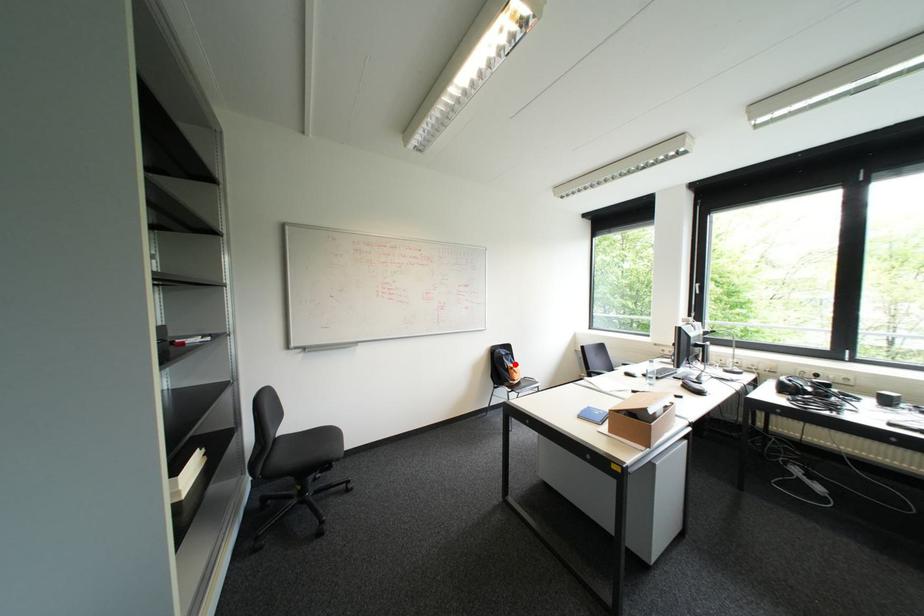
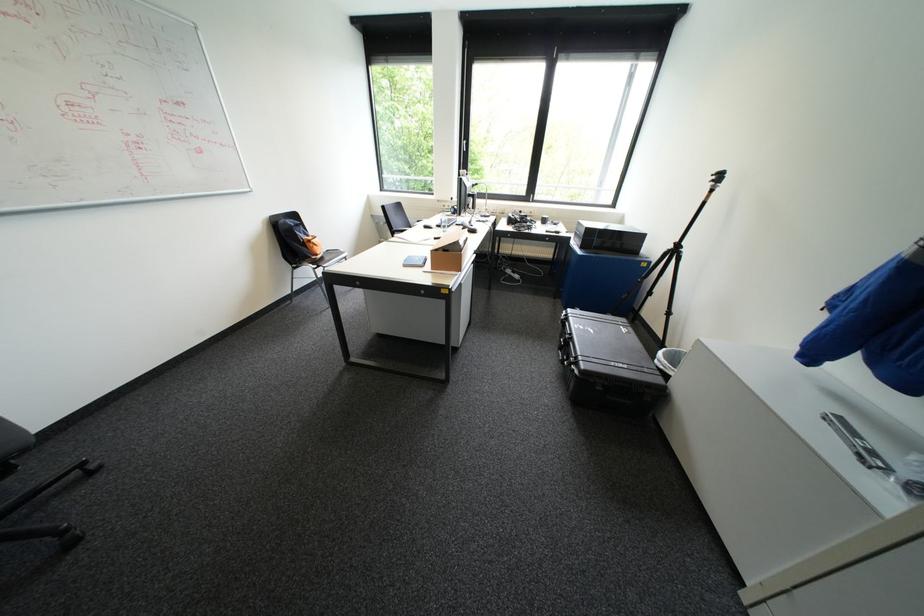
Question: I am providing you with two images of the same scene from different viewpoints. Image1 has a red point marked. In image2, the corresponding 3D location appears at what relative position? Reply with the corresponding letter.

Choices:
 (A) Closer
 (B) Farther

Answer: (A)